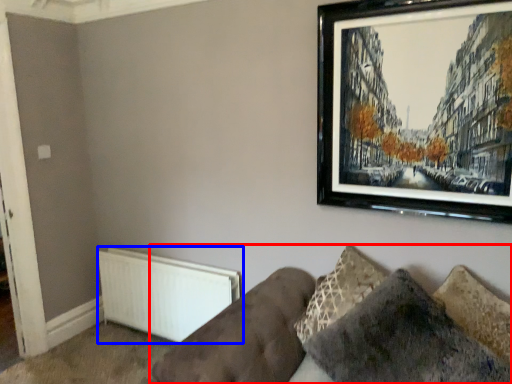
Question: Which point is closer to the camera, studio couch (highlighted by a red box) or radiator (highlighted by a blue box)?

Choices:
 (A) studio couch
 (B) radiator

Answer: (A)